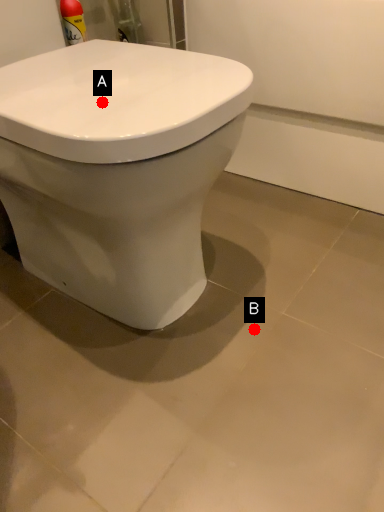
Question: Two points are circled on the image, labeled by A and B beside each circle. Which point is further to the camera?

Choices:
 (A) A is further
 (B) B is further

Answer: (B)